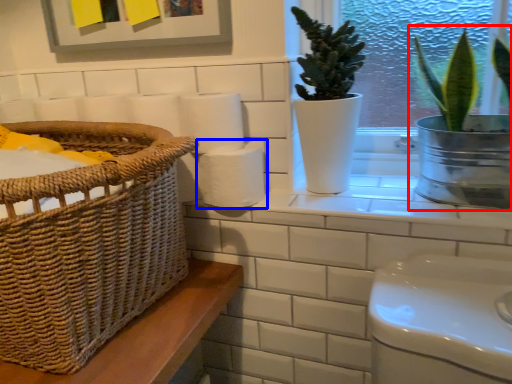
Question: Which of the following is the farthest to the observer, houseplant (highlighted by a red box) or toilet paper (highlighted by a blue box)?

Choices:
 (A) houseplant
 (B) toilet paper

Answer: (B)